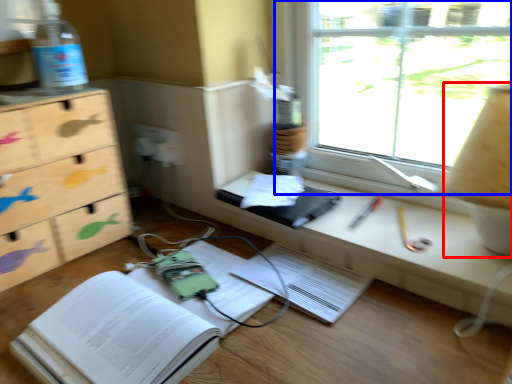
Question: Which object appears farthest to the camera in this image, table lamp (highlighted by a red box) or window (highlighted by a blue box)?

Choices:
 (A) table lamp
 (B) window

Answer: (B)